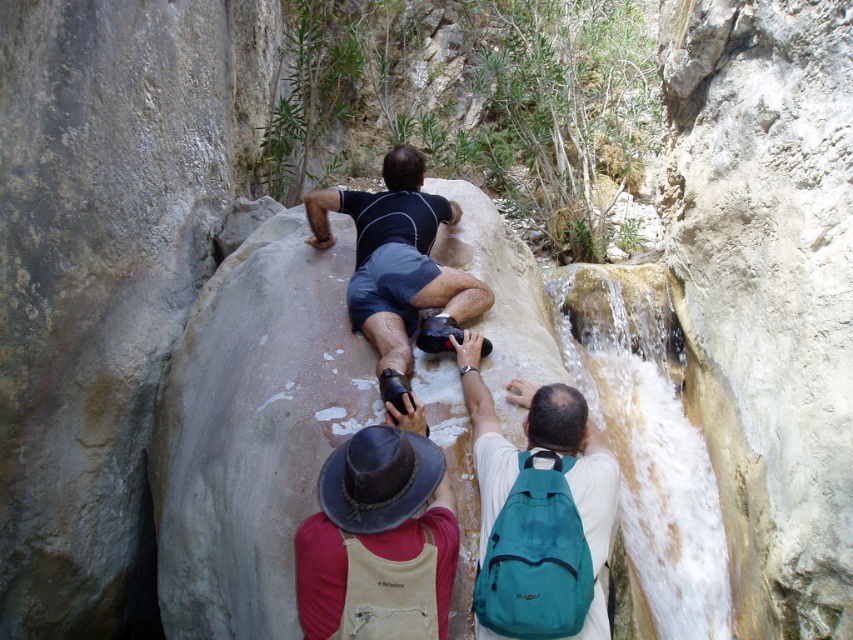
Question: Is clear water at waterfall right above teal fabric backpack at center?

Choices:
 (A) no
 (B) yes

Answer: (A)

Question: Does clear water at waterfall right come behind teal fabric backpack at center?

Choices:
 (A) yes
 (B) no

Answer: (A)

Question: Which is farther from the dark blue shorts at center?

Choices:
 (A) clear water at waterfall right
 (B) teal fabric backpack at center
 (C) brown leather hat at upper center

Answer: (A)

Question: Is teal fabric backpack at center above dark blue shorts at center?

Choices:
 (A) yes
 (B) no

Answer: (B)

Question: Which point is closer to the camera taking this photo?

Choices:
 (A) (595, 634)
 (B) (384, 518)
 (C) (440, 202)
 (D) (672, 324)

Answer: (B)

Question: Which of the following is the closest to the observer?

Choices:
 (A) teal fabric backpack at center
 (B) brown leather hat at upper center
 (C) clear water at waterfall right

Answer: (A)